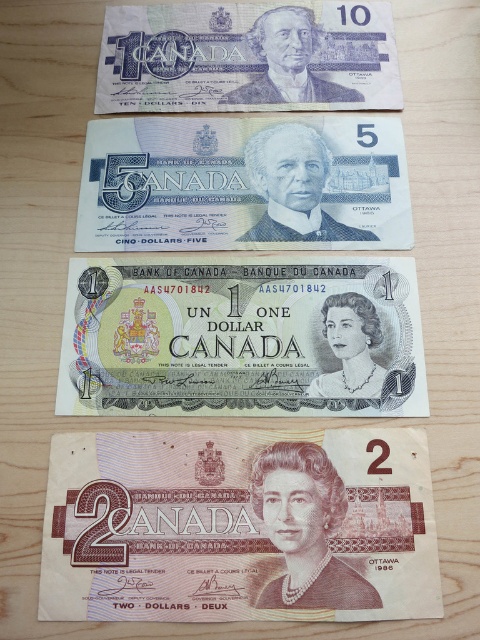
Does point (145, 284) come in front of point (361, 132)?

Yes.

Who is positioned more to the left, light green paper at center or blue paper money at center?

light green paper at center is more to the left.

Who is more forward, (396,332) or (235,225)?

Point (396,332) is in front.

The height and width of the screenshot is (640, 480). What are the coordinates of `light green paper at center` in the screenshot? It's located at (242, 339).

Which is more to the left, blue paper money at center or matte purple banknote at upper center?

From the viewer's perspective, blue paper money at center appears more on the left side.

Does blue paper money at center appear under matte purple banknote at upper center?

Correct, blue paper money at center is located below matte purple banknote at upper center.

Between point (188, 209) and point (228, 70), which one is positioned behind?

Point (228, 70)

Where is `blue paper money at center`? blue paper money at center is located at coordinates (243, 182).

Does light brown paper money at bottom have a lesser width compared to matte purple banknote at upper center?

Indeed, light brown paper money at bottom has a lesser width compared to matte purple banknote at upper center.

Can you confirm if light brown paper money at bottom is positioned below matte purple banknote at upper center?

Yes, light brown paper money at bottom is below matte purple banknote at upper center.

This screenshot has height=640, width=480. I want to click on light brown paper money at bottom, so click(x=240, y=525).